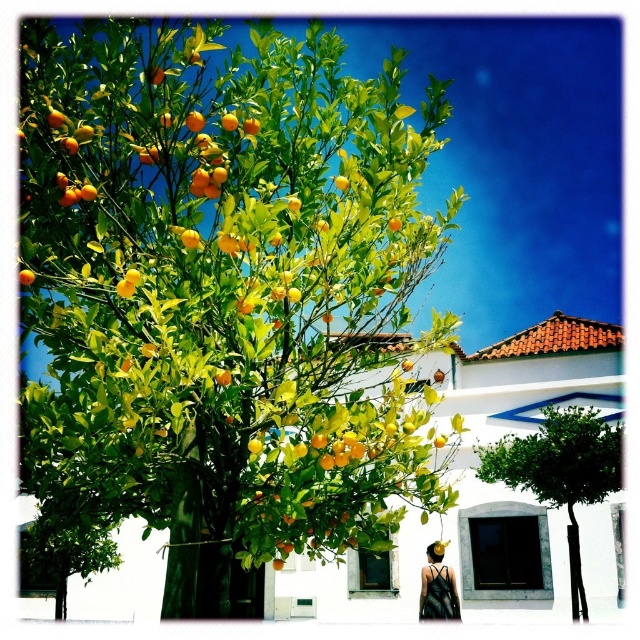
Between green leafy fruit tree at center and green leafy tree at center, which one has more height?

green leafy fruit tree at center is taller.

Is point (115, 426) less distant than point (573, 570)?

Yes, point (115, 426) is closer to viewer.

Is point (253, 308) positioned in front of point (563, 451)?

Yes, it is in front of point (563, 451).

You are a GUI agent. You are given a task and a screenshot of the screen. Output one action in this format:
    pyautogui.click(x=<x>, y=<y>)
    Task: Click on the green leafy fruit tree at center
    
    Given the screenshot: What is the action you would take?
    pyautogui.click(x=225, y=291)

Does point (529, 461) come in front of point (435, 541)?

Yes.

Between green leafy tree at center and matte black dress at lower right, which one is positioned lower?

matte black dress at lower right is lower down.

What are the coordinates of `green leafy tree at center` in the screenshot? It's located at (561, 472).

The image size is (640, 640). I want to click on green leafy tree at center, so click(561, 472).

Does green leafy fruit tree at center have a lesser height compared to matte black dress at lower right?

In fact, green leafy fruit tree at center may be taller than matte black dress at lower right.

Does green leafy fruit tree at center come behind matte black dress at lower right?

No, it is in front of matte black dress at lower right.

Is point (426, 410) more distant than point (456, 593)?

No.

The height and width of the screenshot is (640, 640). In order to click on green leafy fruit tree at center in this screenshot , I will do `click(225, 291)`.